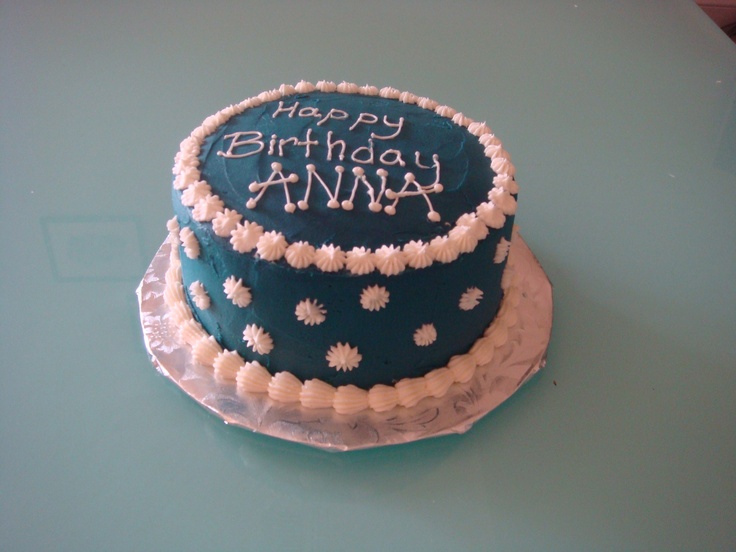
This screenshot has width=736, height=552. What are the coordinates of `plate` in the screenshot? It's located at (495, 386).